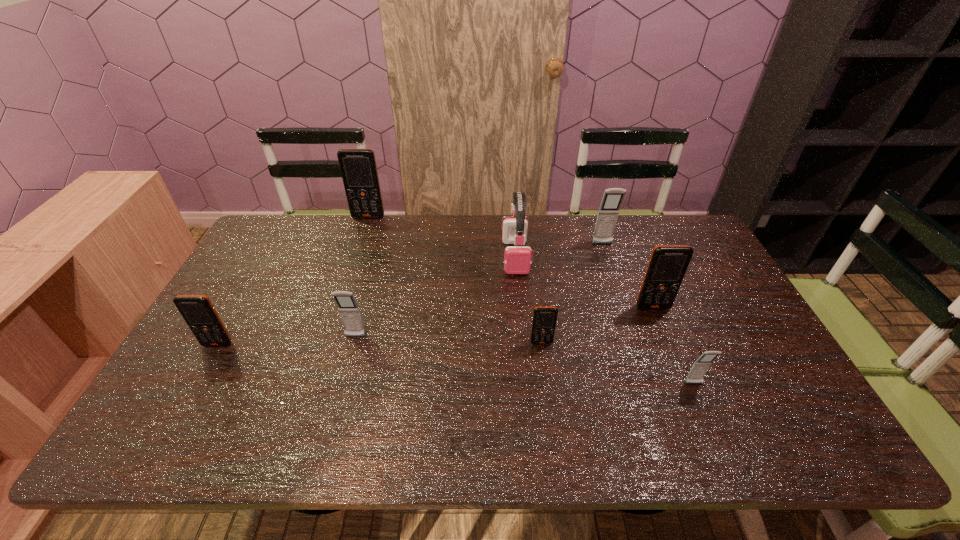
Where is `the farthest orange cellular telephone`? The image size is (960, 540). the farthest orange cellular telephone is located at coordinates (358, 167).

You are a GUI agent. You are given a task and a screenshot of the screen. Output one action in this format:
    pyautogui.click(x=<x>, y=<y>)
    Task: Click on the tallest cellular telephone
    
    Given the screenshot: What is the action you would take?
    pyautogui.click(x=358, y=167)

Image resolution: width=960 pixels, height=540 pixels. I want to click on earphone, so click(x=517, y=260).

Locate an element on the screen. Image resolution: width=960 pixels, height=540 pixels. the second farthest cellular telephone is located at coordinates (608, 212).

Where is `the biggest gray cellular telephone`? This screenshot has width=960, height=540. the biggest gray cellular telephone is located at coordinates (608, 212).

In order to click on the rightmost orange cellular telephone in this screenshot , I will do `click(667, 266)`.

You are a GUI agent. You are given a task and a screenshot of the screen. Output one action in this format:
    pyautogui.click(x=<x>, y=<y>)
    Task: Click on the third farthest cellular telephone
    The width and height of the screenshot is (960, 540).
    Given the screenshot: What is the action you would take?
    pyautogui.click(x=667, y=266)

You are a GUI agent. You are given a task and a screenshot of the screen. Output one action in this format:
    pyautogui.click(x=<x>, y=<y>)
    Task: Click on the second nearest gray cellular telephone
    Image resolution: width=960 pixels, height=540 pixels.
    Given the screenshot: What is the action you would take?
    pyautogui.click(x=350, y=314)

This screenshot has width=960, height=540. I want to click on the second smallest gray cellular telephone, so click(x=350, y=314).

Where is `the leftmost object`? The image size is (960, 540). the leftmost object is located at coordinates (197, 310).